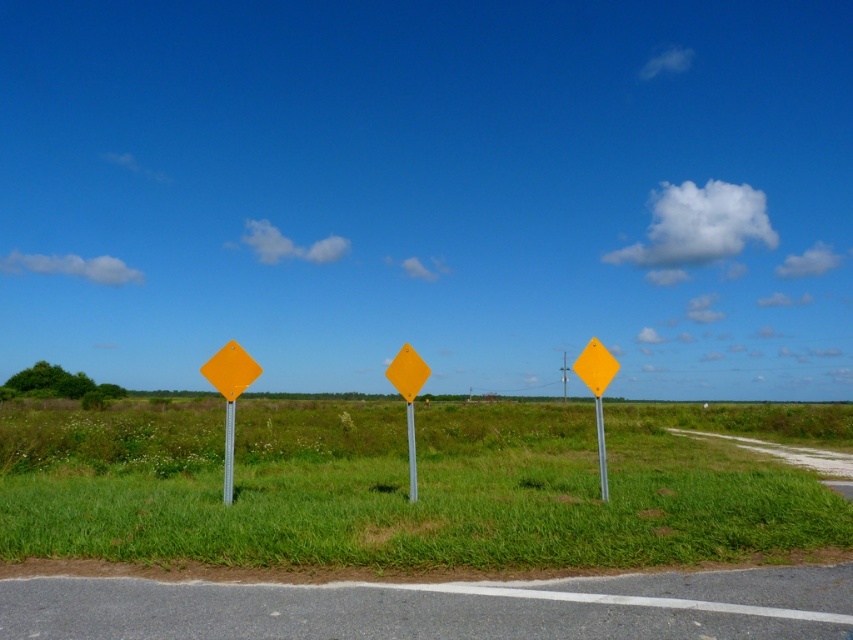
Measure the distance from matte yellow diamond at left to yellow diamond sign at center.

matte yellow diamond at left and yellow diamond sign at center are 3.30 meters apart from each other.

Between point (224, 432) and point (410, 474), which one is positioned behind?

The point (224, 432) is behind.

This screenshot has width=853, height=640. I want to click on matte yellow diamond at left, so click(x=229, y=396).

Image resolution: width=853 pixels, height=640 pixels. Find the location of `matte yellow diamond at left`. matte yellow diamond at left is located at coordinates [229, 396].

Is green grass at center shorter than yellow plastic signpost at left?

In fact, green grass at center may be taller than yellow plastic signpost at left.

Is green grass at center positioned in front of yellow plastic signpost at left?

Yes, green grass at center is in front of yellow plastic signpost at left.

Which is behind, point (291, 525) or point (227, 490)?

The point (227, 490) is more distant.

At what (x,y) coordinates should I click in order to perform the action: click on green grass at center. Please return your answer as a coordinate pair (x, y). The width and height of the screenshot is (853, 640). Looking at the image, I should click on (407, 484).

Which is more to the left, matte yellow diamond at center or yellow diamond-shaped sign at left?

yellow diamond-shaped sign at left

What do you see at coordinates (596, 394) in the screenshot? I see `matte yellow diamond at center` at bounding box center [596, 394].

Between point (584, 381) and point (222, 358), which one is positioned in front?

Point (222, 358) is in front.

The width and height of the screenshot is (853, 640). Identify the location of matte yellow diamond at center. (596, 394).